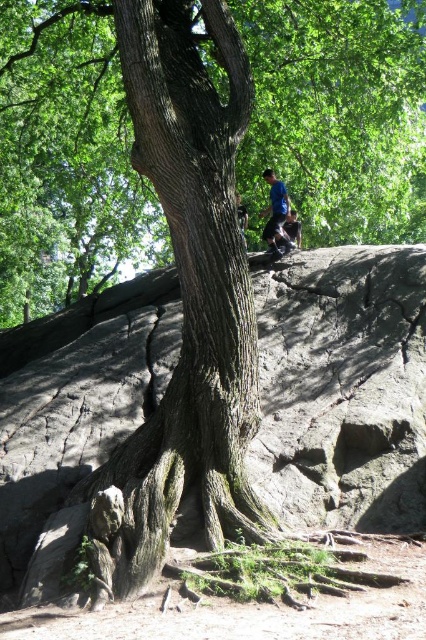
You are standing near the rough bark tree trunk at center and want to throw a small stone to reach the blue fabric shirt at upper center. If the maximum distance you can throw is 4 meters, will you be able to reach it?

The distance between the rough bark tree trunk at center and the blue fabric shirt at upper center is 4.71 meters. Since your maximum throw is 4 meters, you cannot reach the blue fabric shirt at upper center.

You are standing in the natural outdoor scene and want to place a small rock between the rough bark tree trunk at center and the blue fabric shirt at upper center. Which direction should you move the rock from the tree trunk to reach the shirt?

The rough bark tree trunk at center is located below the blue fabric shirt at upper center, so you should move the rock upward from the tree trunk toward the shirt.